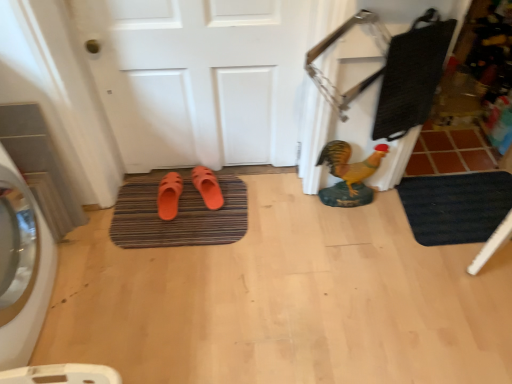
Image resolution: width=512 pixels, height=384 pixels. What are the coordinates of `vacant area to the right of brown textured bath mat at center, marked as the first bath mat in a left-to-right arrangement` in the screenshot? It's located at (281, 233).